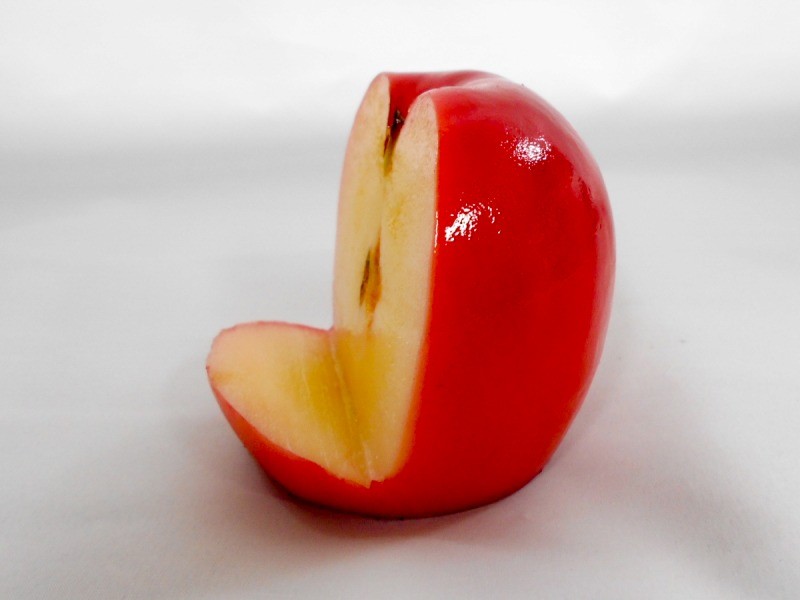
This screenshot has width=800, height=600. What are the coordinates of `table` in the screenshot? It's located at (118, 251), (154, 377), (569, 511), (634, 339), (680, 204).